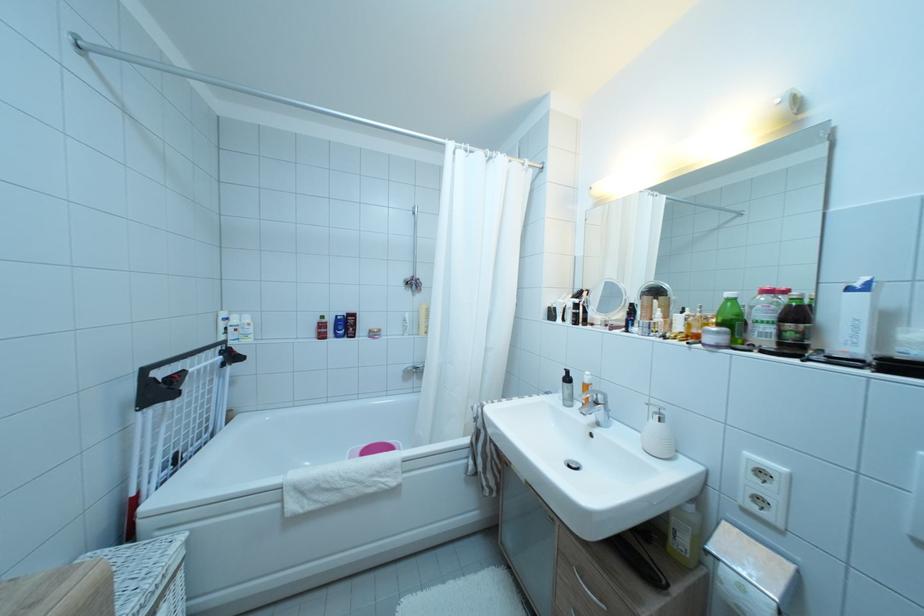
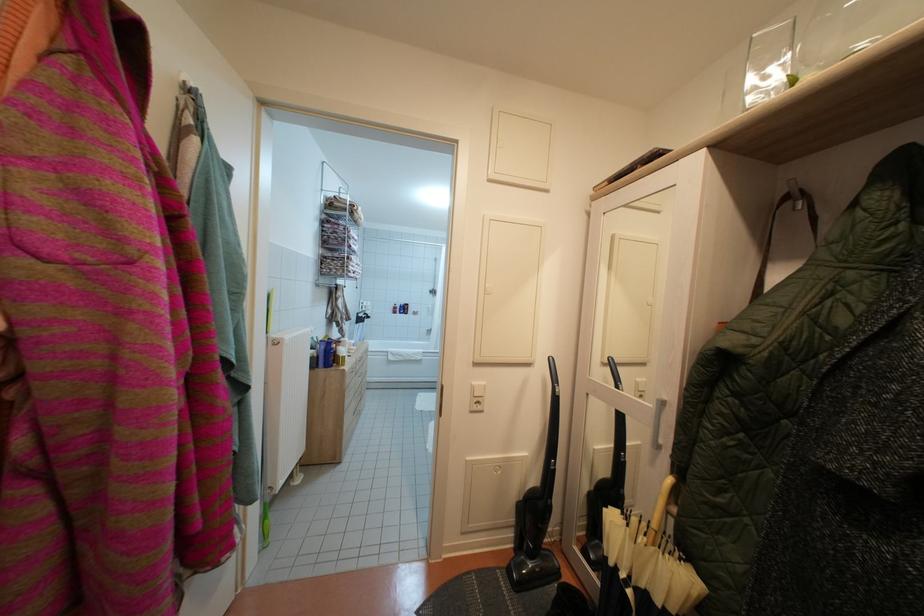
Question: The images are taken continuously from a first-person perspective. In which direction are you moving?

Choices:
 (A) Left
 (B) Right
 (C) Forward
 (D) Backward

Answer: (D)